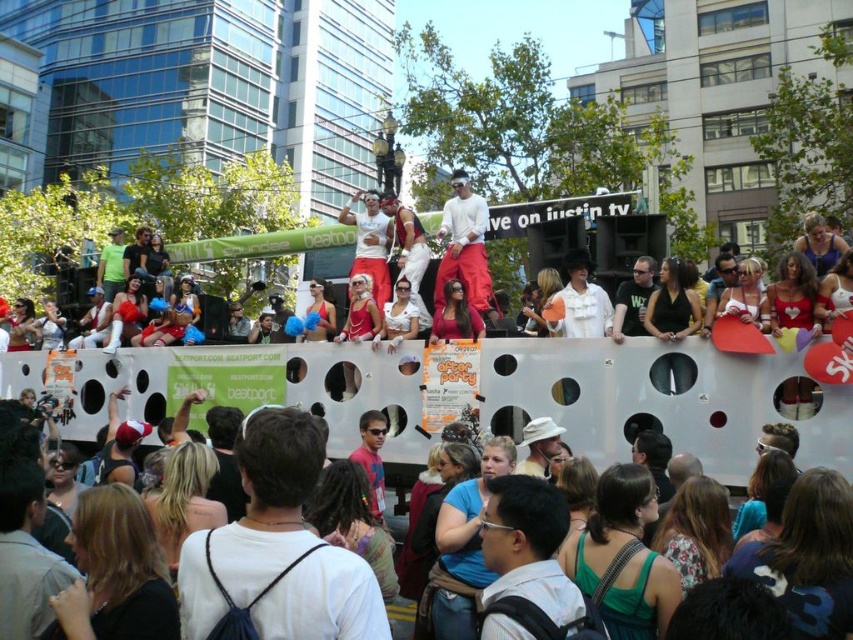
Question: Which point is closer to the camera?

Choices:
 (A) matte black t-shirt at center
 (B) white cotton shirt at center
 (C) white matte shirt at center
 (D) white matte hat at center

Answer: (D)

Question: Can you confirm if white matte shirt at center is positioned to the left of green fabric shirt at center?

Choices:
 (A) no
 (B) yes

Answer: (A)

Question: Which object is positioned closest to the white cotton shirt at center?

Choices:
 (A) matte black t-shirt at center
 (B) shiny metallic tank top at center
 (C) white matte backpack at center
 (D) green fabric shirt at center

Answer: (B)

Question: Which of these objects is positioned farthest from the shiny metallic tank top at center?

Choices:
 (A) white cotton shirt at center
 (B) matte black t-shirt at center
 (C) white matte backpack at center
 (D) white matte shirt at center

Answer: (C)

Question: Does white matte shirt at center appear over matte black t-shirt at center?

Choices:
 (A) no
 (B) yes

Answer: (B)

Question: Is the position of matte white crowd at center less distant than that of white matte hat at center?

Choices:
 (A) yes
 (B) no

Answer: (A)